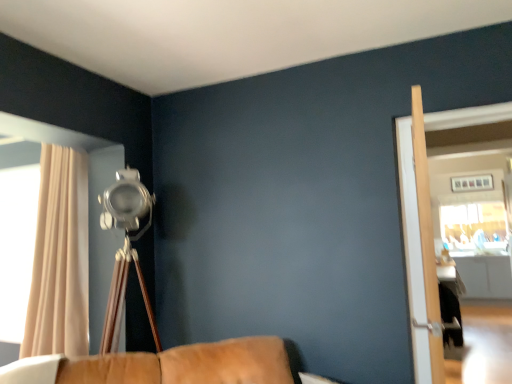
Question: Is beige fabric curtain at left taller or shorter than light wood screen door at right, the 1th screen door when ordered from left to right?

Choices:
 (A) tall
 (B) short

Answer: (A)

Question: Is beige fabric curtain at left inside the boundaries of light wood screen door at right, which is the second screen door from right to left, or outside?

Choices:
 (A) inside
 (B) outside

Answer: (B)

Question: Estimate the real-world distances between objects in this image. Which object is closer to the light wood screen door at right, the 1th screen door when ordered from left to right?

Choices:
 (A) brown leather couch at lower center
 (B) clear glass screen door at right, which is counted as the second screen door, starting from the left
 (C) beige fabric curtain at left

Answer: (B)

Question: Which is nearer to the light wood screen door at right, which is the second screen door from right to left?

Choices:
 (A) beige fabric curtain at left
 (B) clear glass screen door at right, arranged as the 1th screen door when viewed from the right
 (C) brown leather couch at lower center

Answer: (B)